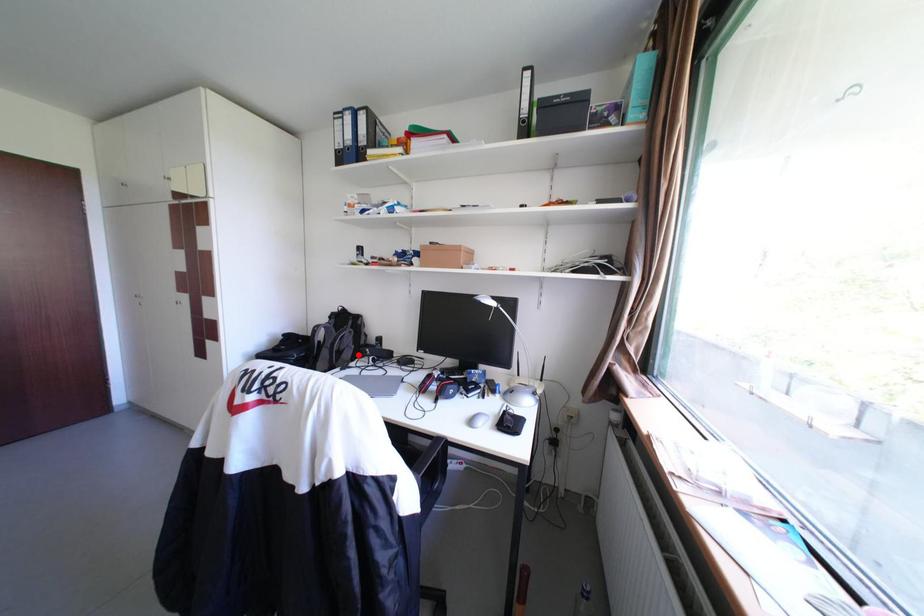
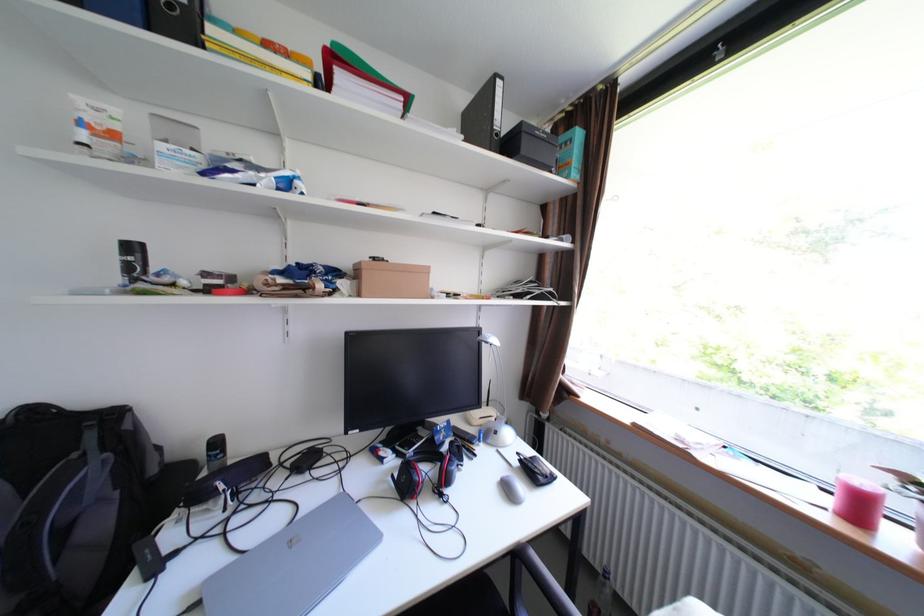
Question: I am providing you with two images of the same scene from different viewpoints. A red point is marked on the first image. Can you still see the location of the red point in image 2?

Choices:
 (A) Yes
 (B) No

Answer: (A)